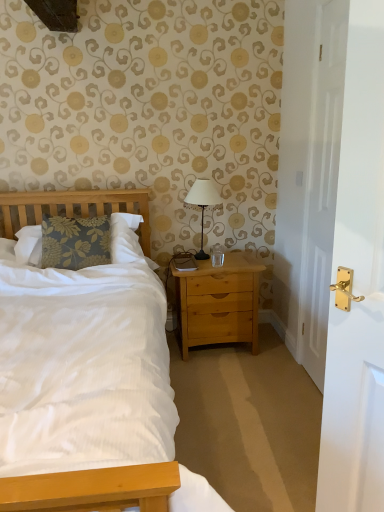
Describe the element at coordinates (202, 204) in the screenshot. This screenshot has height=512, width=384. I see `matte black lamp at center` at that location.

What do you see at coordinates (218, 302) in the screenshot? Image resolution: width=384 pixels, height=512 pixels. I see `light brown wood nightstand at right` at bounding box center [218, 302].

Find the location of `matte black lamp at center`. matte black lamp at center is located at coordinates click(x=202, y=204).

Between white glossy door at right and light brown wood nightstand at right, which one appears on the left side from the viewer's perspective?

Positioned to the left is light brown wood nightstand at right.

Is white glossy door at right outside of light brown wood nightstand at right?

Indeed, white glossy door at right is completely outside light brown wood nightstand at right.

This screenshot has height=512, width=384. I want to click on door above the light brown wood nightstand at right (from the image's perspective), so (321, 185).

Would you say matte black lamp at center is outside light brown wood nightstand at right?

Yes, matte black lamp at center is located beyond the bounds of light brown wood nightstand at right.

Is matte black lamp at center in front of or behind light brown wood nightstand at right in the image?

matte black lamp at center is behind light brown wood nightstand at right.

Is matte black lamp at center far from light brown wood nightstand at right?

matte black lamp at center is actually quite close to light brown wood nightstand at right.

Is point (202, 199) positioned behind point (235, 326)?

No, (202, 199) is closer to viewer.

Between light brown wood nightstand at right and white glossy door at right, which one appears on the right side from the viewer's perspective?

white glossy door at right.

Which is behind, light brown wood nightstand at right or white glossy door at right?

light brown wood nightstand at right is more distant.

Is there a large distance between light brown wood nightstand at right and white glossy door at right?

That's not correct — light brown wood nightstand at right is a little close to white glossy door at right.

Does point (201, 341) lie behind point (332, 191)?

Yes, it is.

In terms of width, does light brown wood nightstand at right look wider or thinner when compared to matte black lamp at center?

In the image, light brown wood nightstand at right appears to be wider than matte black lamp at center.

Considering the relative sizes of light brown wood nightstand at right and matte black lamp at center in the image provided, is light brown wood nightstand at right taller than matte black lamp at center?

Indeed, light brown wood nightstand at right has a greater height compared to matte black lamp at center.

In terms of size, does light brown wood nightstand at right appear bigger or smaller than matte black lamp at center?

light brown wood nightstand at right is bigger than matte black lamp at center.

Is there a large distance between white glossy door at right and matte black lamp at center?

That's not correct — white glossy door at right is a little close to matte black lamp at center.

Between white glossy door at right and matte black lamp at center, which one appears on the left side from the viewer's perspective?

From the viewer's perspective, matte black lamp at center appears more on the left side.

Which point is more forward, (x=307, y=198) or (x=204, y=194)?

The point (x=307, y=198) is more forward.

From a real-world perspective, is matte black lamp at center over white glossy door at right?

No.

Is there a large distance between matte black lamp at center and white glossy door at right?

No.

Is matte black lamp at center wider or thinner than white glossy door at right?

In the image, matte black lamp at center appears to be wider than white glossy door at right.

Which is farther from the camera, (218, 200) or (324, 156)?

The point (218, 200) is more distant.

Find the location of a particular element. door located above the light brown wood nightstand at right (from a real-world perspective) is located at coordinates (321, 185).

Image resolution: width=384 pixels, height=512 pixels. Identify the location of nightstand on the right of matte black lamp at center. (218, 302).

Estimate the real-world distances between objects in this image. Which object is further from white glossy door at right, light brown wood nightstand at right or matte black lamp at center?

matte black lamp at center is further to white glossy door at right.

Which object lies nearer to the anchor point white glossy door at right, matte black lamp at center or light brown wood nightstand at right?

Among the two, light brown wood nightstand at right is located nearer to white glossy door at right.

Which object lies further to the anchor point light brown wood nightstand at right, matte black lamp at center or white glossy door at right?

white glossy door at right.

Based on their spatial positions, is white glossy door at right or light brown wood nightstand at right closer to matte black lamp at center?

Based on the image, light brown wood nightstand at right appears to be nearer to matte black lamp at center.

Considering their positions, is white glossy door at right positioned further to light brown wood nightstand at right than matte black lamp at center?

Among the two, white glossy door at right is located further to light brown wood nightstand at right.

Looking at the image, which one is located further to matte black lamp at center, light brown wood nightstand at right or white glossy door at right?

white glossy door at right lies further to matte black lamp at center than the other object.

The height and width of the screenshot is (512, 384). I want to click on nightstand between white glossy door at right and matte black lamp at center in the front-back direction, so click(218, 302).